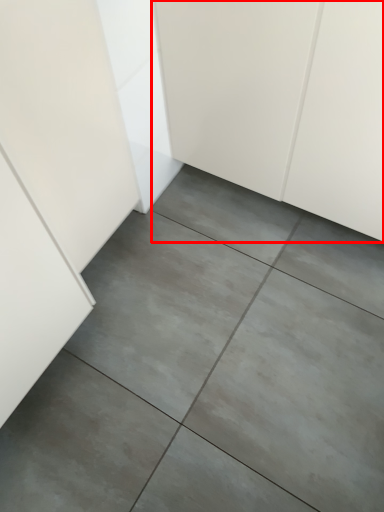
Question: From the image's perspective, what is the correct spatial relationship of cabinetry (annotated by the red box) in relation to concrete?

Choices:
 (A) below
 (B) above

Answer: (B)